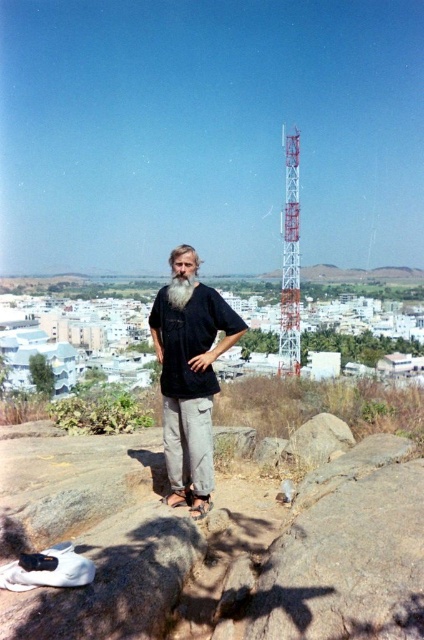
Can you confirm if black matte shirt at center is positioned below smooth gray rock at center?

Actually, black matte shirt at center is above smooth gray rock at center.

Can you confirm if black matte shirt at center is wider than smooth gray rock at center?

Yes, black matte shirt at center is wider than smooth gray rock at center.

Between point (187, 451) and point (236, 451), which one is positioned in front?

Point (187, 451)

The image size is (424, 640). I want to click on black matte shirt at center, so click(190, 387).

In the scene shown: Which is above, smooth gray rock at center or white soft beard at center?

white soft beard at center is higher up.

Consider the image. Can you confirm if smooth gray rock at center is smaller than white soft beard at center?

No.

Does point (248, 445) come in front of point (175, 291)?

No, it is not.

This screenshot has height=640, width=424. Find the location of `smooth gray rock at center`. smooth gray rock at center is located at coordinates (233, 442).

Consider the image. Can you confirm if black matte shirt at center is smaller than brown rough rock at center?

Actually, black matte shirt at center might be larger than brown rough rock at center.

Is point (172, 406) in front of point (312, 451)?

Yes, it is in front of point (312, 451).

Image resolution: width=424 pixels, height=640 pixels. What do you see at coordinates (190, 387) in the screenshot? I see `black matte shirt at center` at bounding box center [190, 387].

Locate an element on the screen. black matte shirt at center is located at coordinates click(x=190, y=387).